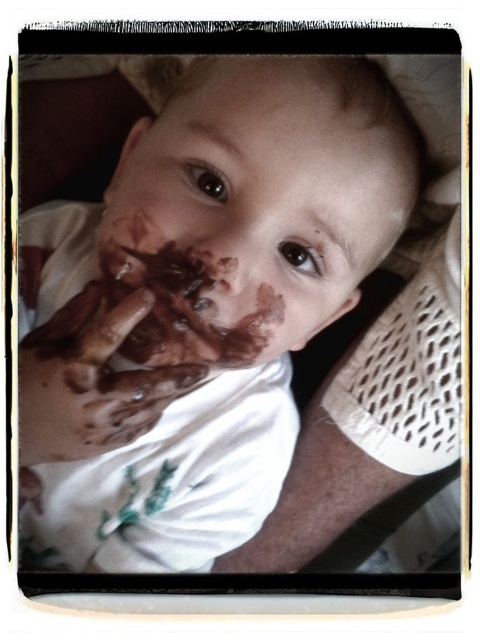
Which of these two, chocolate matte face at center or chocolatey skin at center, stands taller?

chocolate matte face at center is taller.

Locate an element on the screen. This screenshot has width=480, height=640. chocolate matte face at center is located at coordinates (256, 205).

Is chocolate matte hands at center shorter than chocolatey skin at center?

No, chocolate matte hands at center is not shorter than chocolatey skin at center.

Is chocolate matte hands at center taller than chocolatey skin at center?

Indeed, chocolate matte hands at center has a greater height compared to chocolatey skin at center.

Between point (156, 374) and point (143, 374), which one is positioned in front?

Point (143, 374) is in front.

The height and width of the screenshot is (640, 480). I want to click on chocolate matte hands at center, so click(197, 307).

From the picture: Is chocolate matte hands at center above chocolate matte face at center?

Incorrect, chocolate matte hands at center is not positioned above chocolate matte face at center.

Is point (153, 349) less distant than point (168, 161)?

No.

Locate an element on the screen. The image size is (480, 640). chocolate matte hands at center is located at coordinates (197, 307).